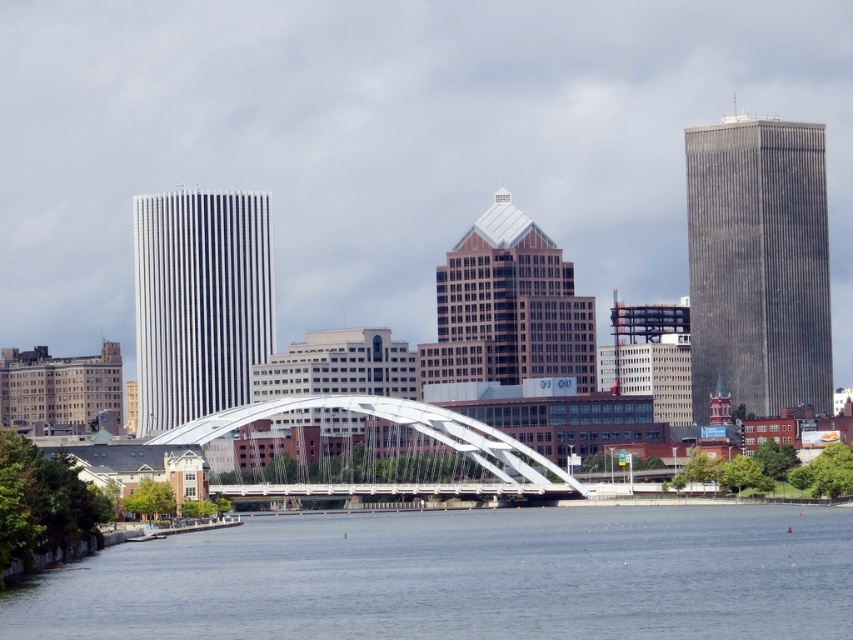
Which of these two, blue water at lower center or white glass skyscraper at center-left, stands shorter?

blue water at lower center is shorter.

Can you confirm if blue water at lower center is shorter than white glass skyscraper at center-left?

Indeed, blue water at lower center has a lesser height compared to white glass skyscraper at center-left.

Between point (514, 589) and point (152, 264), which one is positioned in front?

Point (514, 589) is more forward.

Find the location of a particular element. This screenshot has width=853, height=640. blue water at lower center is located at coordinates (463, 577).

Between gray concrete skyscraper at right and brown glass skyscraper at center, which one is positioned lower?

brown glass skyscraper at center is lower down.

Is point (808, 148) positioned behind point (569, 333)?

Yes, point (808, 148) is behind point (569, 333).

Where is `gray concrete skyscraper at right`? The image size is (853, 640). gray concrete skyscraper at right is located at coordinates (758, 262).

You are a GUI agent. You are given a task and a screenshot of the screen. Output one action in this format:
    pyautogui.click(x=<x>, y=<y>)
    Task: Click on the gray concrete skyscraper at right
    The width and height of the screenshot is (853, 640).
    Given the screenshot: What is the action you would take?
    pyautogui.click(x=758, y=262)

Does blue water at lower center appear under brown glass skyscraper at center?

Yes, blue water at lower center is below brown glass skyscraper at center.

Does blue water at lower center appear on the left side of brown glass skyscraper at center?

Yes, blue water at lower center is to the left of brown glass skyscraper at center.

Between point (590, 621) and point (534, 230), which one is positioned behind?

Point (534, 230)

This screenshot has width=853, height=640. In order to click on blue water at lower center in this screenshot , I will do `click(463, 577)`.